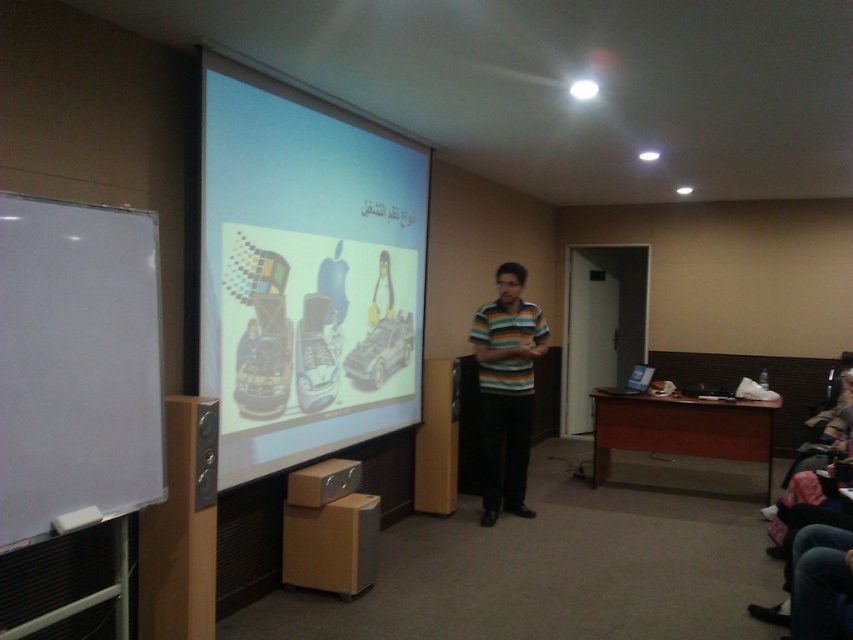
Is white matte projection screen at center bigger than striped cotton shirt at center?

Yes, white matte projection screen at center is bigger than striped cotton shirt at center.

In the scene shown: Does white matte projection screen at center have a smaller size compared to striped cotton shirt at center?

No.

Find the location of a particular element. This screenshot has width=853, height=640. white matte projection screen at center is located at coordinates (305, 273).